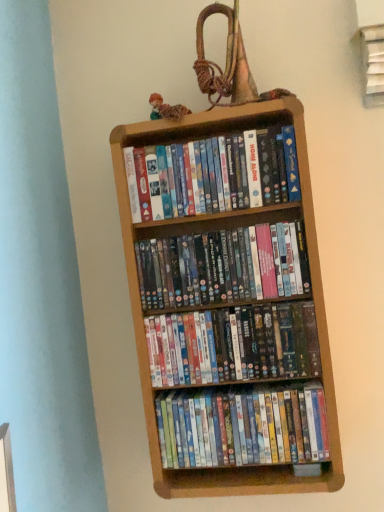
Question: Is multicolored plastic dvds at center, the 3th book when ordered from bottom to top, facing towards multicolored fabric doll at upper center?

Choices:
 (A) no
 (B) yes

Answer: (A)

Question: From a real-world perspective, is multicolored plastic dvds at center, which is counted as the 2th book, starting from the top, physically above multicolored fabric doll at upper center?

Choices:
 (A) no
 (B) yes

Answer: (A)

Question: From the image's perspective, is multicolored plastic dvds at center, which is counted as the 2th book, starting from the top, beneath multicolored fabric doll at upper center?

Choices:
 (A) yes
 (B) no

Answer: (A)

Question: Does multicolored plastic dvds at center, the 3th book when ordered from bottom to top, have a larger size compared to multicolored fabric doll at upper center?

Choices:
 (A) no
 (B) yes

Answer: (B)

Question: Is multicolored plastic dvds at center, the 3th book when ordered from bottom to top, not inside multicolored fabric doll at upper center?

Choices:
 (A) yes
 (B) no

Answer: (A)

Question: In terms of width, does multicolored plastic dvds at center, the 3th book when ordered from bottom to top, look wider or thinner when compared to wooden bookcase at center?

Choices:
 (A) wide
 (B) thin

Answer: (A)

Question: Considering the positions of multicolored plastic dvds at center, which is counted as the 2th book, starting from the top, and wooden bookcase at center in the image, is multicolored plastic dvds at center, which is counted as the 2th book, starting from the top, taller or shorter than wooden bookcase at center?

Choices:
 (A) tall
 (B) short

Answer: (B)

Question: In the image, is multicolored plastic dvds at center, which is counted as the 2th book, starting from the top, positioned in front of or behind wooden bookcase at center?

Choices:
 (A) behind
 (B) front

Answer: (B)

Question: From the image's perspective, is multicolored plastic dvds at center, the 3th book when ordered from bottom to top, above or below wooden bookcase at center?

Choices:
 (A) below
 (B) above

Answer: (B)

Question: From their relative heights in the image, would you say wooden bookcase at center is taller or shorter than multicolored fabric doll at upper center?

Choices:
 (A) tall
 (B) short

Answer: (A)

Question: Visually, is wooden bookcase at center positioned to the left or to the right of multicolored fabric doll at upper center?

Choices:
 (A) left
 (B) right

Answer: (B)

Question: From a real-world perspective, relative to multicolored fabric doll at upper center, is wooden bookcase at center vertically above or below?

Choices:
 (A) above
 (B) below

Answer: (B)

Question: In the image, is wooden bookcase at center positioned in front of or behind multicolored fabric doll at upper center?

Choices:
 (A) behind
 (B) front

Answer: (B)

Question: Considering the positions of multicolored plastic dvds at center, which is counted as the 2th book, starting from the top, and matte plastic dvds at center, which is counted as the 3th book, starting from the top, in the image, is multicolored plastic dvds at center, which is counted as the 2th book, starting from the top, taller or shorter than matte plastic dvds at center, which is counted as the 3th book, starting from the top,?

Choices:
 (A) tall
 (B) short

Answer: (B)

Question: Is multicolored plastic dvds at center, which is counted as the 2th book, starting from the top, to the left or to the right of matte plastic dvds at center, which is counted as the 3th book, starting from the top, in the image?

Choices:
 (A) right
 (B) left

Answer: (B)